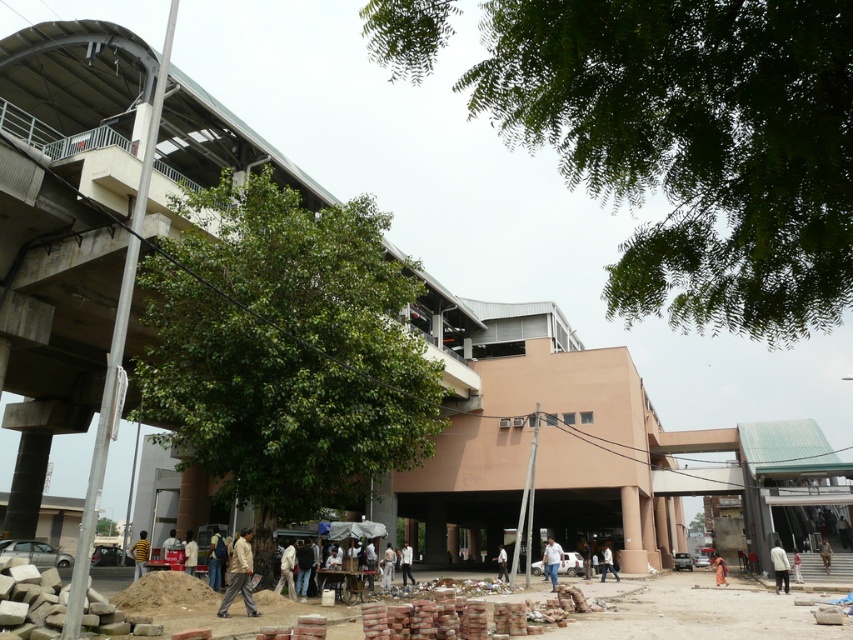
You are standing at the construction area in the urban scene and want to determine the relative positions of two points marked in the image. Which point, point 1 at coordinates (138, 572) or point 2 at coordinates (390, 557), is closer to you from your current viewpoint?

Point 1 at coordinates (138, 572) is closer to you because it is in front of point 2 at coordinates (390, 557).

You are standing at the center of the urban scene described. You need to locate the white matte shirt at lower right. Based on the coordinates provided, in which direction should you look to find it?

The white matte shirt at lower right is located at point coordinates of (779,566). Since the coordinates are in the lower right quadrant, you should look towards the lower right direction to find it.

You are standing at the camera position in the urban scene. There is a person wearing a white matte shirt at lower right. Can you comfortably take a photo of them without zooming in?

The distance between the camera and the white matte shirt at lower right is 21.94 meters. Since this distance is quite far, you would need to zoom in significantly to capture a clear photo of the person wearing the white matte shirt at lower right.